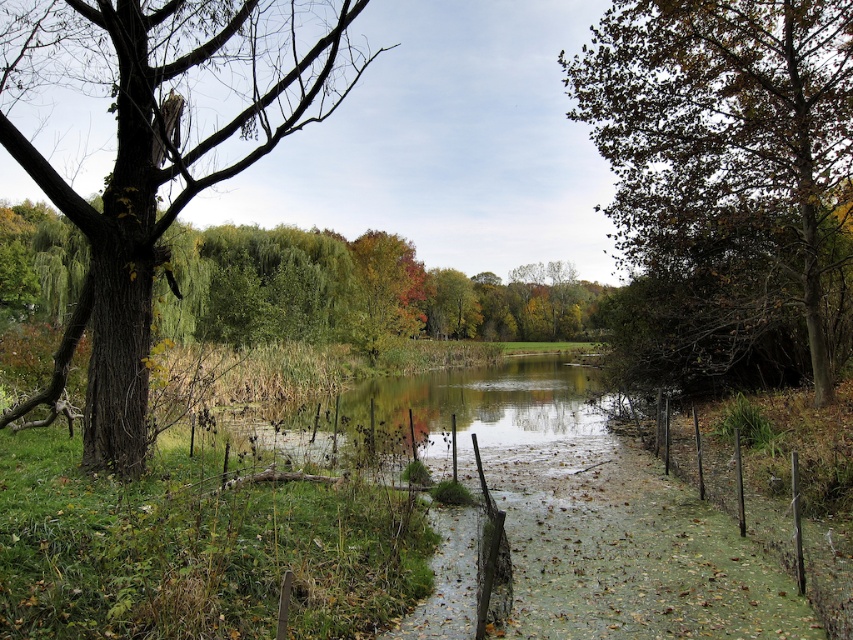
Question: Based on their relative distances, which object is nearer to the brown rough bark tree at left?

Choices:
 (A) brown leafy tree at right
 (B) green leafy tree at center

Answer: (B)

Question: Does brown rough bark tree at left have a greater width compared to green leafy tree at center?

Choices:
 (A) yes
 (B) no

Answer: (B)

Question: Is brown leafy tree at right closer to the viewer compared to green leafy tree at center?

Choices:
 (A) yes
 (B) no

Answer: (B)

Question: Does brown rough bark tree at left have a smaller size compared to brown leafy tree at right?

Choices:
 (A) no
 (B) yes

Answer: (A)

Question: Based on their relative distances, which object is farther from the brown leafy tree at right?

Choices:
 (A) brown rough bark tree at left
 (B) green leafy tree at center

Answer: (B)

Question: Which object is farther from the camera taking this photo?

Choices:
 (A) brown leafy tree at right
 (B) brown rough bark tree at left
 (C) green leafy tree at center

Answer: (A)